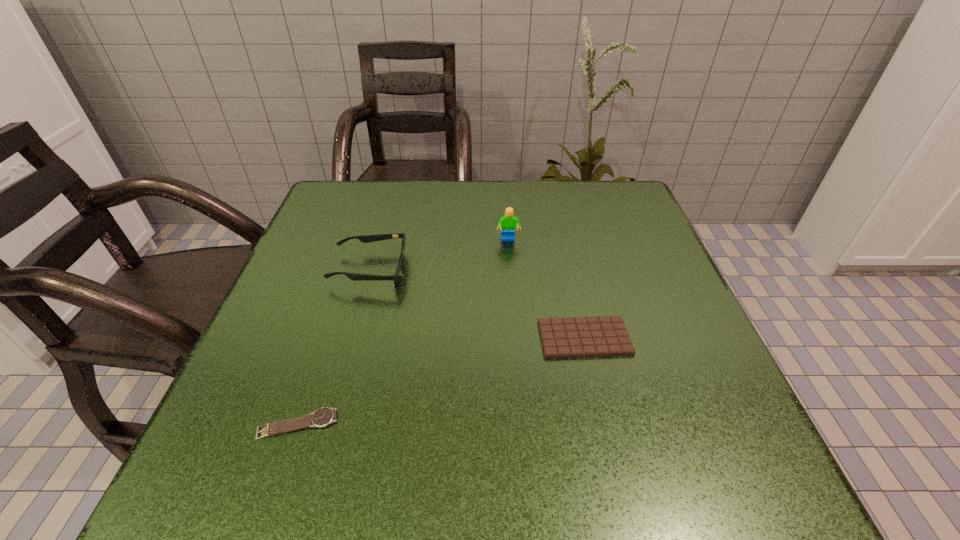
The width and height of the screenshot is (960, 540). I want to click on vacant space at the right edge, so click(636, 349).

Identify the location of free space at the far left corner. (323, 202).

In the image, there is a desktop. At what (x,y) coordinates should I click in order to perform the action: click on vacant space at the near left corner. Please return your answer as a coordinate pair (x, y). The image size is (960, 540). Looking at the image, I should click on (257, 446).

Find the location of a particular element. Image resolution: width=960 pixels, height=540 pixels. vacant space at the far right corner is located at coordinates [x=571, y=180].

I want to click on empty space that is in between the farthest object and the watch, so click(x=403, y=332).

Find the location of a particular element. This screenshot has width=960, height=540. vacant area that lies between the third shortest object and the second shortest object is located at coordinates (477, 303).

I want to click on free area in between the second nearest object and the Lego, so click(546, 289).

What are the coordinates of `blank region between the farthest object and the second shortest object` in the screenshot? It's located at (546, 289).

Where is `blank region between the third farthest object and the second farthest object`? The width and height of the screenshot is (960, 540). blank region between the third farthest object and the second farthest object is located at coordinates (477, 303).

Where is `free point between the third nearest object and the nearest object`? The width and height of the screenshot is (960, 540). free point between the third nearest object and the nearest object is located at coordinates (334, 347).